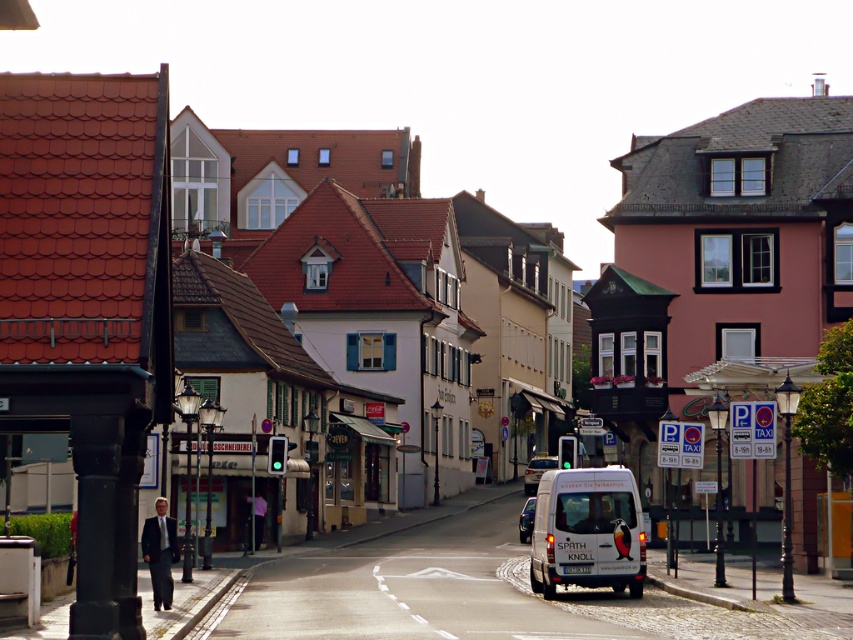
Between metallic silver van at center and metallic blue van at center, which one appears on the right side from the viewer's perspective?

From the viewer's perspective, metallic silver van at center appears more on the right side.

Does point (532, 464) come behind point (531, 518)?

Yes, it is.

In order to click on metallic silver van at center in this screenshot , I will do `click(537, 472)`.

Does white matte van at center have a lesser height compared to metallic silver van at center?

In fact, white matte van at center may be taller than metallic silver van at center.

Does white matte van at center lie in front of metallic silver van at center?

Yes, it is.

This screenshot has height=640, width=853. Identify the location of white matte van at center. (587, 531).

Is white matte van at center thinner than metallic blue van at center?

Yes.

The height and width of the screenshot is (640, 853). In order to click on white matte van at center in this screenshot , I will do `click(587, 531)`.

Image resolution: width=853 pixels, height=640 pixels. Describe the element at coordinates (587, 531) in the screenshot. I see `white matte van at center` at that location.

Where is `white matte van at center`? This screenshot has height=640, width=853. white matte van at center is located at coordinates (587, 531).